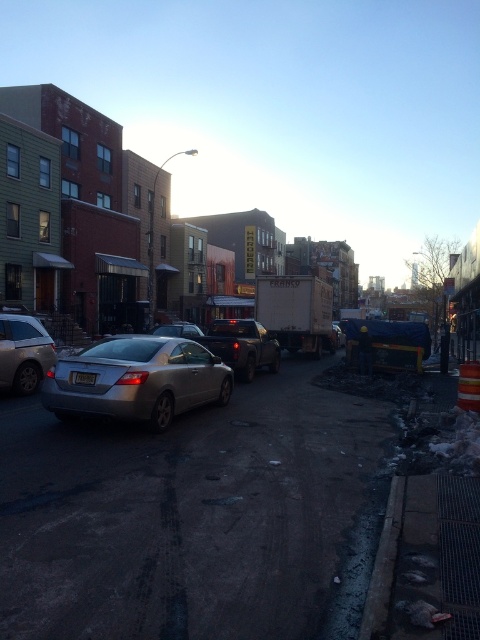
Based on the photo, is the position of satin silver sedan at center less distant than that of matte black truck at center?

Yes, it is.

Does satin silver sedan at center appear over matte black truck at center?

Actually, satin silver sedan at center is below matte black truck at center.

Who is more forward, (186, 342) or (220, 353)?

Point (186, 342)

Identify the location of satin silver sedan at center. (136, 380).

Which is more to the right, silver metallic sedan at left or matte black truck at center?

matte black truck at center

Between point (17, 365) and point (230, 321), which one is positioned behind?

Point (230, 321)

I want to click on silver metallic sedan at left, so click(x=24, y=353).

Find the location of `silver metallic sedan at left`. silver metallic sedan at left is located at coordinates (24, 353).

Between satin silver sedan at center and silver metallic sedan at left, which one is positioned higher?

silver metallic sedan at left

Is point (202, 371) farther from viewer compared to point (32, 330)?

No, it is not.

Measure the distance between satin silver sedan at center and camera.

25.50 feet

Locate an element on the screen. satin silver sedan at center is located at coordinates (136, 380).